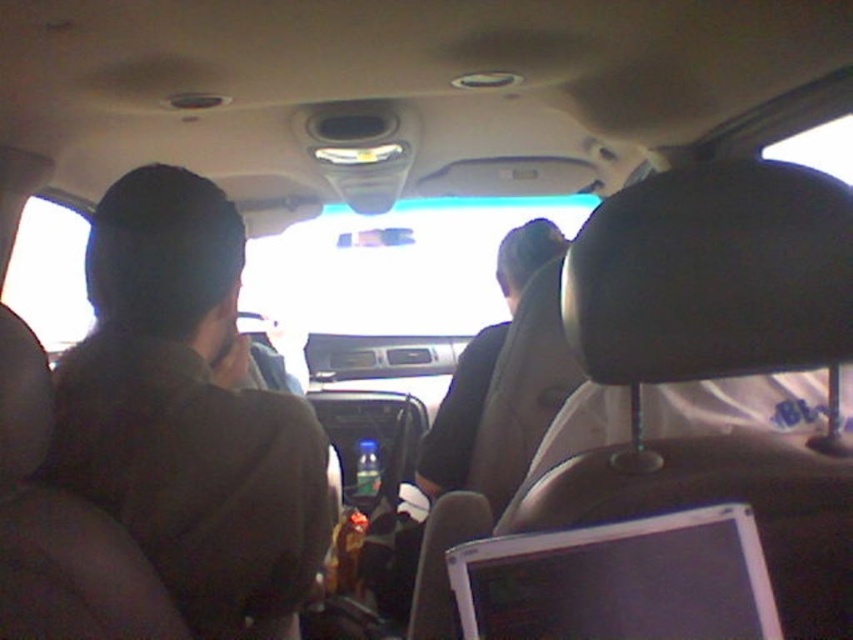
You are sitting in the back seat of a moving car and need to place your phone on a stable surface. The dark brown fabric at left and the silver plastic laptop at lower right are both visible. Which surface would be more stable for placing your phone?

The dark brown fabric at left is positioned over the silver plastic laptop at lower right. Since the fabric is covering the laptop, placing the phone on the dark brown fabric at left would be more stable as it is likely a part of the car seat or interior surface, whereas the laptop might move if disturbed.

You are a passenger in the back seat of a moving car. You want to grab the dark brown fabric at left to steady yourself. Where should you reach relative to the dashboard?

The dark brown fabric at left is located at point 0.645 on the x axis and 0.222 on the y axis relative to the dashboard.